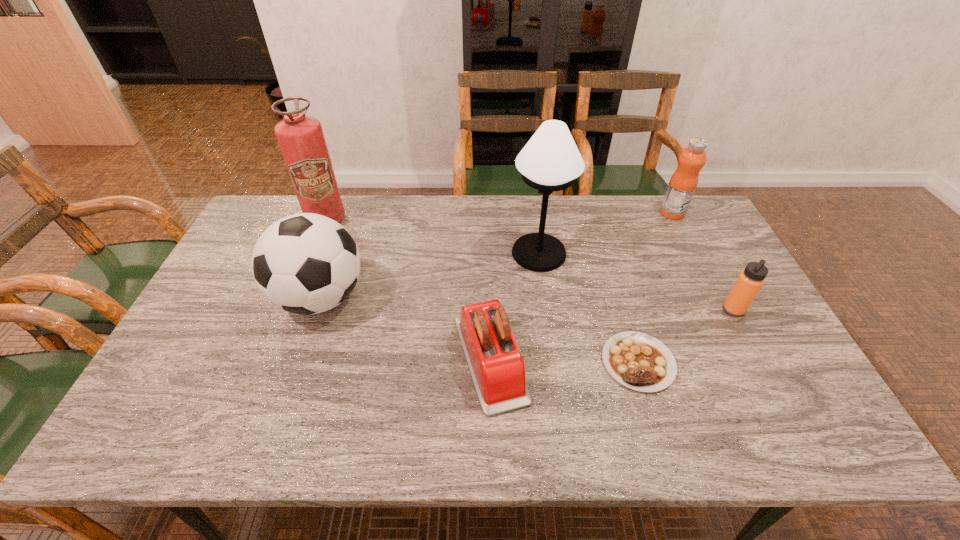
The height and width of the screenshot is (540, 960). Identify the location of table lamp. (550, 161).

Where is `fire extinguisher`? fire extinguisher is located at coordinates (300, 137).

This screenshot has width=960, height=540. In order to click on fruit juice in this screenshot , I will do `click(682, 185)`.

Find the location of `soccer ball`. soccer ball is located at coordinates (306, 263).

You are a GUI agent. You are given a task and a screenshot of the screen. Output one action in this format:
    pyautogui.click(x=<x>, y=<y>)
    Task: Click on the thermos bottle
    Image resolution: width=960 pixels, height=540 pixels.
    Given the screenshot: What is the action you would take?
    pyautogui.click(x=749, y=282)

Locate an element on the screen. This screenshot has height=540, width=960. toaster is located at coordinates (497, 368).

What are the coordinates of `the third object from right to left` in the screenshot? It's located at (638, 361).

What are the coordinates of `the shortest object` in the screenshot? It's located at (638, 361).

The image size is (960, 540). I want to click on free space located 0.050m on the front of the table lamp, so click(543, 286).

Locate an element on the screen. free space located 0.060m on the label side of the fire extinguisher is located at coordinates (316, 244).